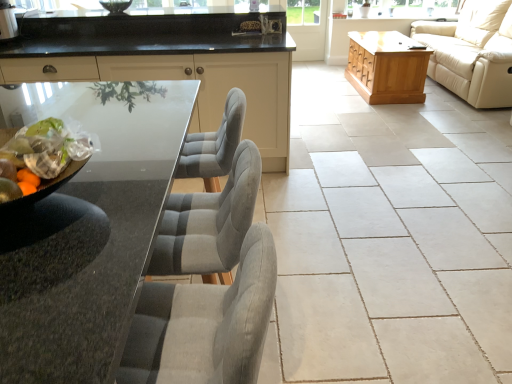
Identify the location of free space in front of light brown wooden chest at right. (398, 116).